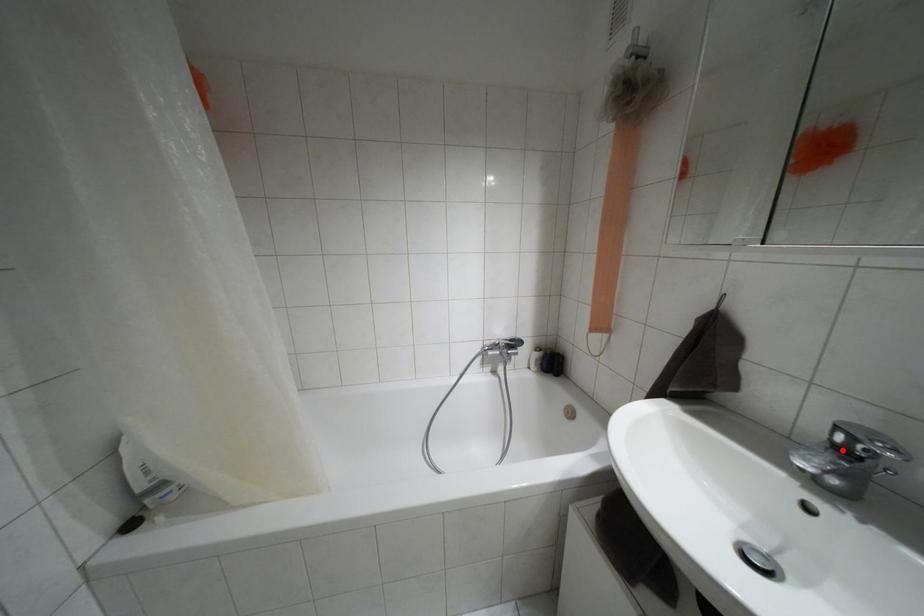
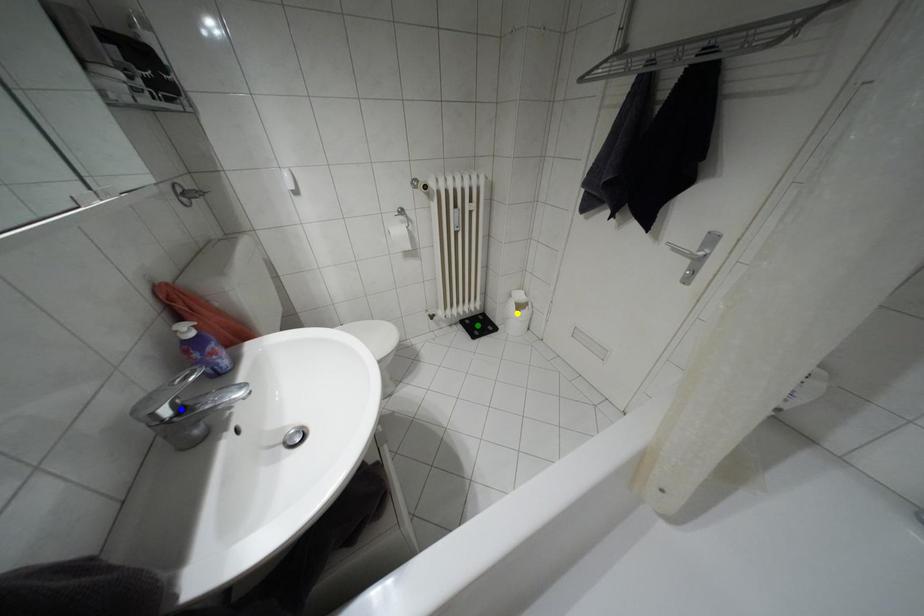
Question: I am providing you with two images of the same scene from different viewpoints. A red point is marked on the first image. You are given multiple points on the second image. Which point in image 2 is actually the same real-world point as the red point in image 1?

Choices:
 (A) green point
 (B) yellow point
 (C) blue point

Answer: (C)